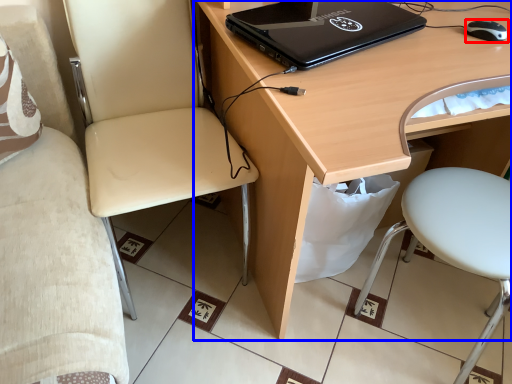
Question: Which object is further to the camera taking this photo, mouse (highlighted by a red box) or desk (highlighted by a blue box)?

Choices:
 (A) mouse
 (B) desk

Answer: (A)